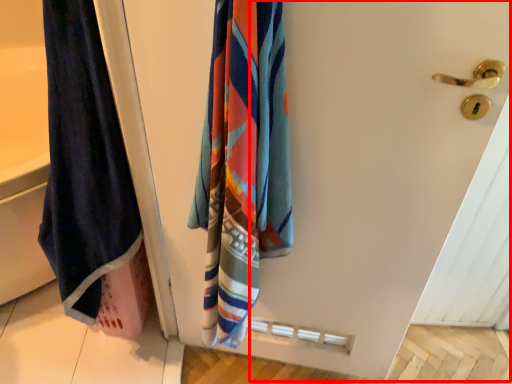
Question: Considering the relative positions of screen door (annotated by the red box) and towel in the image provided, where is screen door (annotated by the red box) located with respect to the staircase?

Choices:
 (A) left
 (B) right

Answer: (B)